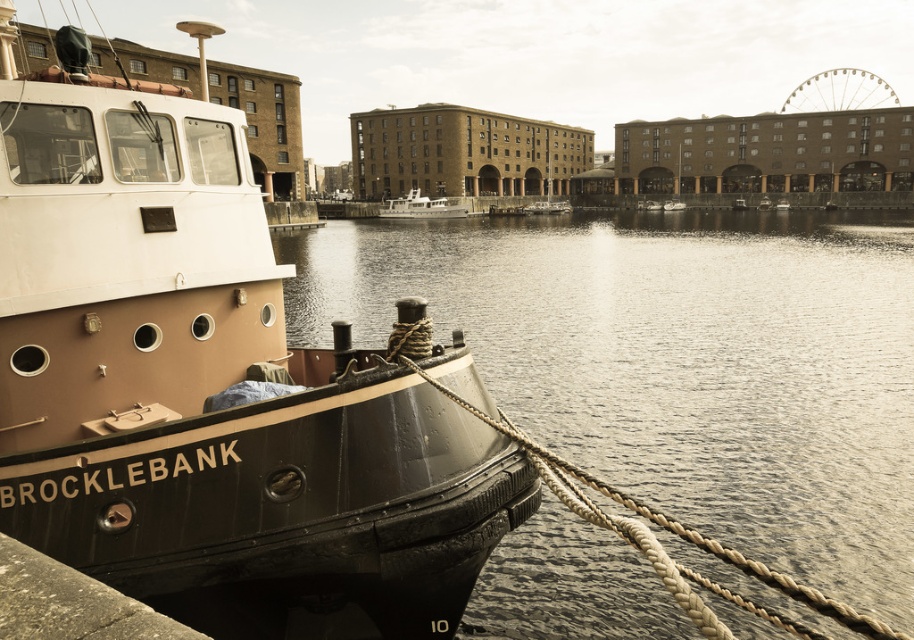
Question: Is white glossy boat at center smaller than matte black boat at center?

Choices:
 (A) no
 (B) yes

Answer: (A)

Question: Which is nearer to the white glossy boat at center?

Choices:
 (A) matte black boat at center
 (B) rope at left
 (C) matte black boat at left

Answer: (A)

Question: Estimate the real-world distances between objects in this image. Which object is closer to the white glossy boat at center?

Choices:
 (A) rope at left
 (B) matte black boat at center

Answer: (B)

Question: Observing the image, what is the correct spatial positioning of white glossy boat at center in reference to matte black boat at center?

Choices:
 (A) below
 (B) above

Answer: (A)

Question: Can you confirm if matte black boat at left is positioned above matte black boat at center?

Choices:
 (A) no
 (B) yes

Answer: (A)

Question: Which point is farther to the camera?

Choices:
 (A) white glossy boat at center
 (B) matte black boat at left
 (C) matte black boat at center

Answer: (C)